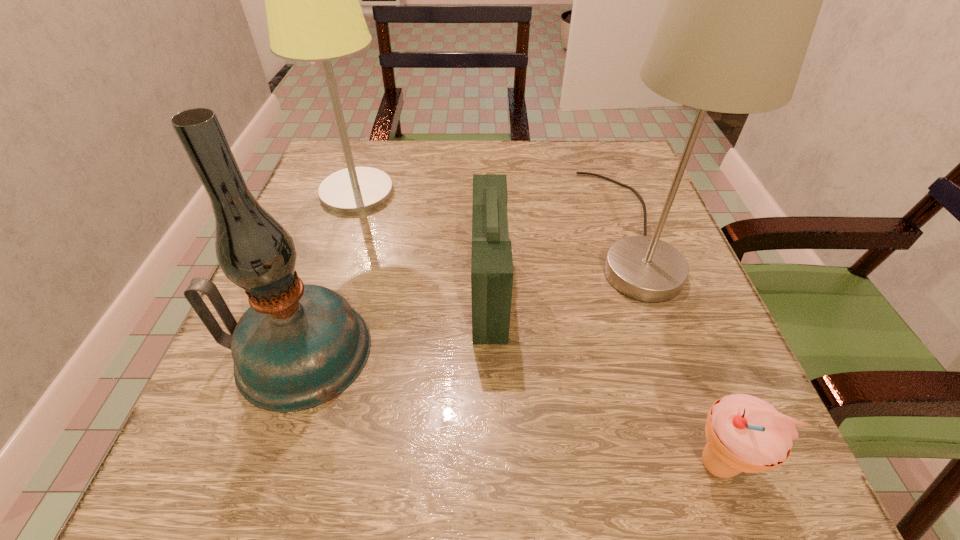
This screenshot has height=540, width=960. I want to click on free spot between the first-aid kit and the left table lamp, so click(423, 241).

The width and height of the screenshot is (960, 540). I want to click on free spot between the shortest object and the third shortest object, so click(508, 408).

Locate an element on the screen. The height and width of the screenshot is (540, 960). free area in between the right table lamp and the first-aid kit is located at coordinates (559, 261).

Where is `blank region between the oil lamp and the first-aid kit`? blank region between the oil lamp and the first-aid kit is located at coordinates (395, 321).

Locate an element on the screen. The width and height of the screenshot is (960, 540). vacant region between the first-aid kit and the third tallest object is located at coordinates (395, 321).

At what (x,y) coordinates should I click in order to perform the action: click on free space between the third object from right to left and the third tallest object. Please return your answer as a coordinate pair (x, y). Looking at the image, I should click on (395, 321).

You are a GUI agent. You are given a task and a screenshot of the screen. Output one action in this format:
    pyautogui.click(x=<x>, y=<y>)
    Task: Click on the vacant region between the third object from left to right and the right table lamp
    
    Given the screenshot: What is the action you would take?
    pyautogui.click(x=559, y=261)

Locate an element on the screen. The width and height of the screenshot is (960, 540). vacant area that lies between the third object from left to right and the left table lamp is located at coordinates (423, 241).

Where is `free space between the icecream and the third object from right to left`? This screenshot has height=540, width=960. free space between the icecream and the third object from right to left is located at coordinates (603, 377).

Locate which object is the closest to the third tallest object. Please provide its 2D coordinates. Your answer should be formatted as a tuple, i.e. [(x, y)], where the tuple contains the x and y coordinates of a point satisfying the conditions above.

[(491, 256)]